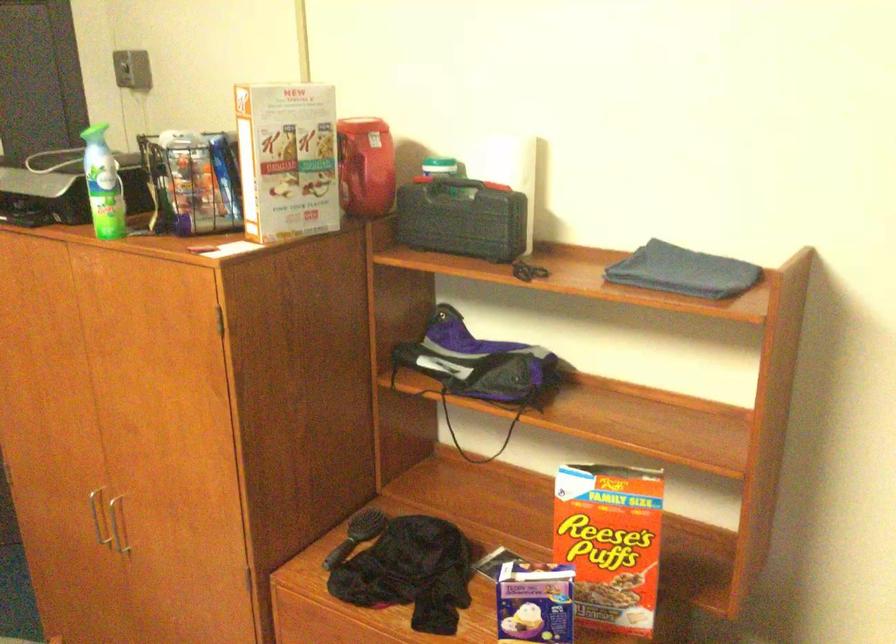
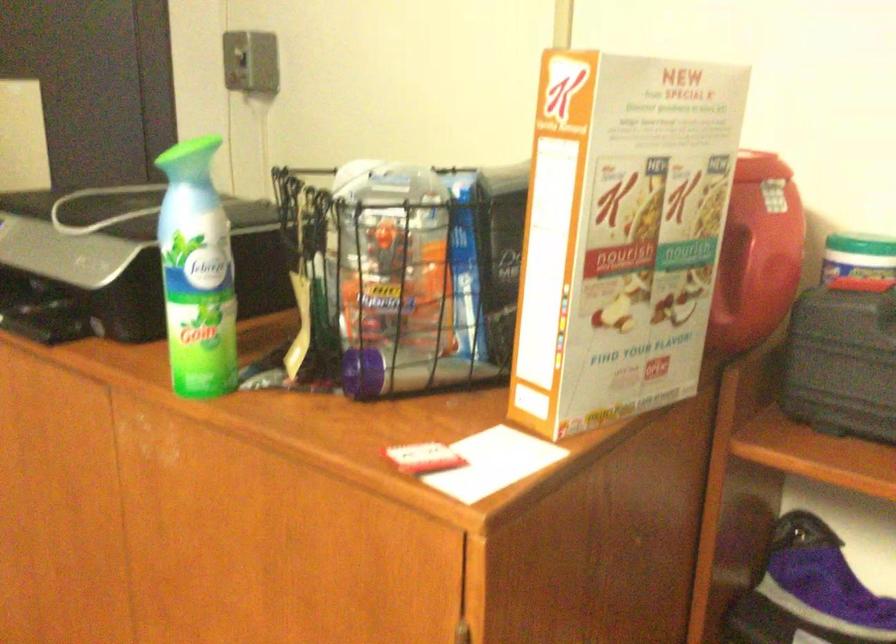
Find the pixel in the second image that matches [431,163] in the first image.

(862, 249)